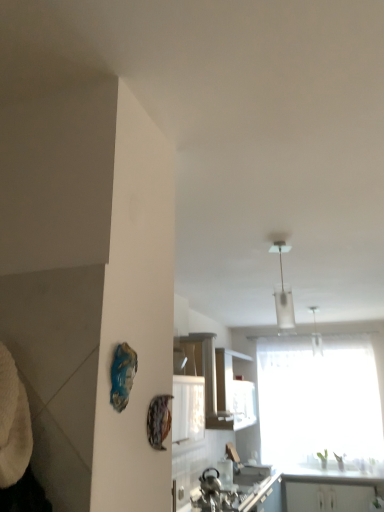
This screenshot has width=384, height=512. Describe the element at coordinates (214, 380) in the screenshot. I see `white glossy cabinet at center, which is the second cabinetry in right-to-left order` at that location.

What is the approximate height of white glossy cabinet at lower right, the 1th cabinetry positioned from the back?

white glossy cabinet at lower right, the 1th cabinetry positioned from the back, is 14.37 inches tall.

You are a GUI agent. You are given a task and a screenshot of the screen. Output one action in this format:
    pyautogui.click(x=<x>, y=<y>)
    Task: Click on the white glossy cabinet at lower right, the 1th cabinetry positioned from the back
    The height and width of the screenshot is (512, 384).
    Given the screenshot: What is the action you would take?
    pyautogui.click(x=327, y=497)

The image size is (384, 512). Identify the location of white glossy cabinet at center, which is counted as the first cabinetry, starting from the left. (214, 380).

Considering the sizes of white glossy countertop at lower right and white glossy cabinet at lower right, placed as the second cabinetry when sorted from top to bottom, in the image, is white glossy countertop at lower right bigger or smaller than white glossy cabinet at lower right, placed as the second cabinetry when sorted from top to bottom,?

Clearly, white glossy countertop at lower right is larger in size than white glossy cabinet at lower right, placed as the second cabinetry when sorted from top to bottom.

Which object is wider, white glossy countertop at lower right or white glossy cabinet at lower right, the 2th cabinetry when ordered from front to back?

Wider between the two is white glossy countertop at lower right.

Is white glossy countertop at lower right looking in the opposite direction of white glossy cabinet at lower right, arranged as the 1th cabinetry when viewed from the right?

No, white glossy cabinet at lower right, arranged as the 1th cabinetry when viewed from the right, is not at the back of white glossy countertop at lower right.

Is white glossy countertop at lower right next to white glossy cabinet at lower right, arranged as the 2th cabinetry when viewed from the left, and touching it?

white glossy countertop at lower right is not next to white glossy cabinet at lower right, arranged as the 2th cabinetry when viewed from the left, and they're not touching.

Who is bigger, white glossy cabinet at lower right, placed as the second cabinetry when sorted from top to bottom, or metallic silver sink at lower center?

With larger size is metallic silver sink at lower center.

Who is more distant, white glossy cabinet at lower right, arranged as the 1th cabinetry when viewed from the right, or metallic silver sink at lower center?

white glossy cabinet at lower right, arranged as the 1th cabinetry when viewed from the right.

Which object is thinner, white glossy cabinet at lower right, arranged as the 1th cabinetry when viewed from the right, or metallic silver sink at lower center?

white glossy cabinet at lower right, arranged as the 1th cabinetry when viewed from the right, is thinner.

Can you tell me how much metallic silver sink at lower center and white glass pendant light at upper center differ in facing direction?

The facing directions of metallic silver sink at lower center and white glass pendant light at upper center are 91.5 degrees apart.

From a real-world perspective, between metallic silver sink at lower center and white glass pendant light at upper center, who is vertically lower?

In real-world perspective, metallic silver sink at lower center is lower.

Is metallic silver sink at lower center taller or shorter than white glass pendant light at upper center?

Clearly, metallic silver sink at lower center is taller compared to white glass pendant light at upper center.

Which is more to the left, metallic silver sink at lower center or white glass pendant light at upper center?

white glass pendant light at upper center is more to the left.

Looking at this image, in terms of size, does transparent fabric window at center appear bigger or smaller than white glossy cabinet at lower right, the first cabinetry in the bottom-to-top sequence?

In the image, transparent fabric window at center appears to be larger than white glossy cabinet at lower right, the first cabinetry in the bottom-to-top sequence.

Which of these two, transparent fabric window at center or white glossy cabinet at lower right, arranged as the 2th cabinetry when viewed from the left, is wider?

With larger width is transparent fabric window at center.

How many degrees apart are the facing directions of transparent fabric window at center and white glossy cabinet at lower right, placed as the second cabinetry when sorted from top to bottom?

They differ by 0.483 degrees in their facing directions.

Measure the distance between transparent fabric window at center and white glossy cabinet at lower right, the 1th cabinetry positioned from the back.

33.36 inches.

At what (x,y) coordinates should I click in order to perform the action: click on light fixture above the transparent fabric window at center (from the image's perspective). Please return your answer as a coordinate pair (x, y). Looking at the image, I should click on (283, 293).

Can you see white glass pendant light at upper center touching transparent fabric window at center?

No, white glass pendant light at upper center is not making contact with transparent fabric window at center.

Which object is thinner, white glass pendant light at upper center or transparent fabric window at center?

With smaller width is white glass pendant light at upper center.

Who is shorter, white glossy cabinet at lower right, the 2th cabinetry when ordered from front to back, or white glossy countertop at lower right?

With less height is white glossy countertop at lower right.

Is white glossy cabinet at lower right, the 1th cabinetry positioned from the back, in contact with white glossy countertop at lower right?

No, white glossy cabinet at lower right, the 1th cabinetry positioned from the back, is not touching white glossy countertop at lower right.

Is point (286, 499) closer to viewer compared to point (309, 482)?

Yes, it is in front of point (309, 482).

Looking at this image, is white glossy cabinet at lower right, arranged as the 1th cabinetry when viewed from the right, looking in the opposite direction of white glossy countertop at lower right?

No, white glossy cabinet at lower right, arranged as the 1th cabinetry when viewed from the right,'s orientation is not away from white glossy countertop at lower right.

Considering the points (212, 403) and (340, 506), which point is in front, point (212, 403) or point (340, 506)?

The point (212, 403) is in front.

This screenshot has height=512, width=384. I want to click on cabinetry above the white glossy cabinet at lower right, arranged as the 2th cabinetry when viewed from the left (from the image's perspective), so click(214, 380).

Is white glossy cabinet at center, the first cabinetry from the front, aimed at white glossy cabinet at lower right, arranged as the 1th cabinetry when viewed from the right?

No, white glossy cabinet at center, the first cabinetry from the front, is not oriented towards white glossy cabinet at lower right, arranged as the 1th cabinetry when viewed from the right.

Between white glossy cabinet at center, which is the second cabinetry in right-to-left order, and white glossy cabinet at lower right, placed as the second cabinetry when sorted from top to bottom, which one has more height?

With more height is white glossy cabinet at center, which is the second cabinetry in right-to-left order.

Locate an element on the screen. This screenshot has width=384, height=512. cabinetry below the white glossy countertop at lower right (from a real-world perspective) is located at coordinates (327, 497).

Where is `the 2nd cabinetry behind the metallic silver sink at lower center`? The height and width of the screenshot is (512, 384). the 2nd cabinetry behind the metallic silver sink at lower center is located at coordinates (327, 497).

When comparing their distances from white glossy countertop at lower right, does white glossy cabinet at center, which is the second cabinetry in right-to-left order, or transparent fabric window at center seem closer?

transparent fabric window at center.

From the image, which object appears to be farther from white glossy cabinet at center, which is the second cabinetry in right-to-left order, metallic silver sink at lower center or white glossy cabinet at lower right, the 2th cabinetry when ordered from front to back?

white glossy cabinet at lower right, the 2th cabinetry when ordered from front to back.

Considering their positions, is metallic silver sink at lower center positioned further to white glass pendant light at upper center than white glossy cabinet at lower right, the 1th cabinetry positioned from the back?

Among the two, white glossy cabinet at lower right, the 1th cabinetry positioned from the back, is located further to white glass pendant light at upper center.

Which object lies nearer to the anchor point white glossy countertop at lower right, white glossy cabinet at lower right, arranged as the 1th cabinetry when viewed from the right, or white glossy cabinet at center, which appears as the second cabinetry when ordered from the bottom?

Among the two, white glossy cabinet at lower right, arranged as the 1th cabinetry when viewed from the right, is located nearer to white glossy countertop at lower right.

Based on their spatial positions, is transparent fabric window at center or white glossy cabinet at center, which is the second cabinetry in right-to-left order, closer to metallic silver sink at lower center?

Among the two, white glossy cabinet at center, which is the second cabinetry in right-to-left order, is located nearer to metallic silver sink at lower center.

Based on their spatial positions, is metallic silver sink at lower center or white glass pendant light at upper center closer to transparent fabric window at center?

metallic silver sink at lower center.

When comparing their distances from white glass pendant light at upper center, does white glossy countertop at lower right or metallic silver sink at lower center seem further?

white glossy countertop at lower right lies further to white glass pendant light at upper center than the other object.

When comparing their distances from white glossy countertop at lower right, does white glossy cabinet at lower right, arranged as the 2th cabinetry when viewed from the left, or transparent fabric window at center seem further?

The object further to white glossy countertop at lower right is transparent fabric window at center.

Where is `window that lies between white glossy cabinet at center, the first cabinetry from the front, and white glossy cabinet at lower right, the 2th cabinetry when ordered from front to back, from top to bottom`? This screenshot has height=512, width=384. window that lies between white glossy cabinet at center, the first cabinetry from the front, and white glossy cabinet at lower right, the 2th cabinetry when ordered from front to back, from top to bottom is located at coordinates (318, 401).

You are a GUI agent. You are given a task and a screenshot of the screen. Output one action in this format:
    pyautogui.click(x=<x>, y=<y>)
    Task: Click on the window located between metallic silver sink at lower center and white glossy countertop at lower right in the depth direction
    Image resolution: width=384 pixels, height=512 pixels.
    Given the screenshot: What is the action you would take?
    pyautogui.click(x=318, y=401)

Find the location of a particular element. This screenshot has height=512, width=384. cabinetry between white glass pendant light at upper center and white glossy cabinet at lower right, the 2th cabinetry when ordered from front to back, in the up-down direction is located at coordinates (214, 380).

This screenshot has width=384, height=512. Identify the location of window located between white glass pendant light at upper center and white glossy countertop at lower right in the depth direction. (318, 401).